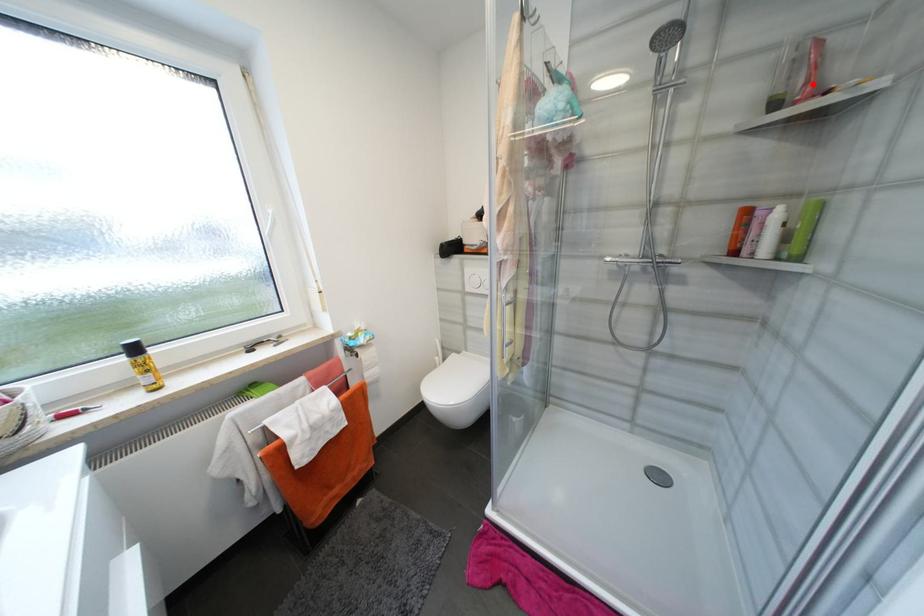
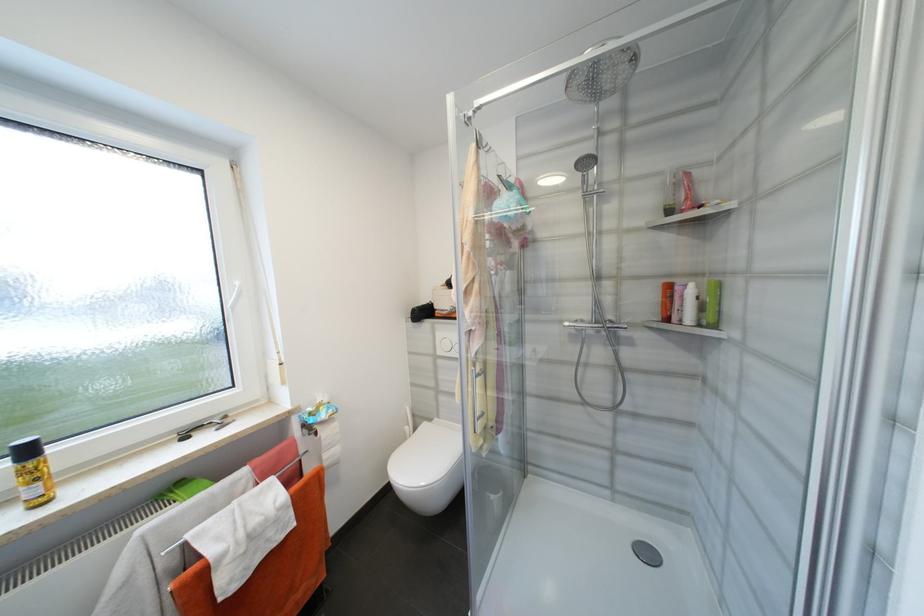
In the second image, find the point that corresponds to the highlighted location in the first image.

(691, 200)